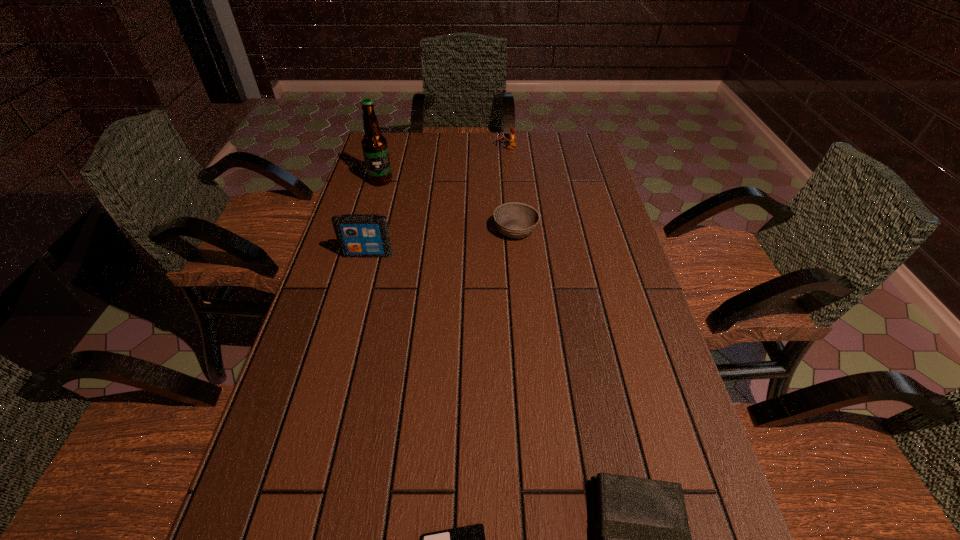
Find the location of `vacant point located between the Lego and the bowl`. vacant point located between the Lego and the bowl is located at coordinates (511, 188).

In order to click on free spot between the bowl and the farthest object in this screenshot , I will do `click(511, 188)`.

At what (x,y) coordinates should I click in order to perform the action: click on empty space between the third tallest object and the taller iPod. Please return your answer as a coordinate pair (x, y). Image resolution: width=960 pixels, height=540 pixels. Looking at the image, I should click on (437, 201).

Select which object appears as the fifth closest to the beer bottle. Please provide its 2D coordinates. Your answer should be formatted as a tuple, i.e. [(x, y)], where the tuple contains the x and y coordinates of a point satisfying the conditions above.

[(641, 538)]

Select which object is the third closest to the taller iPod. Please provide its 2D coordinates. Your answer should be formatted as a tuple, i.e. [(x, y)], where the tuple contains the x and y coordinates of a point satisfying the conditions above.

[(511, 143)]

Locate an element on the screen. The width and height of the screenshot is (960, 540). free location that satisfies the following two spatial constraints: 1. on the back side of the bowl; 2. holding a crossbow in the hands of the Lego is located at coordinates point(508,147).

Locate an element on the screen. vacant area in the image that satisfies the following two spatial constraints: 1. holding a crossbow in the hands of the farthest object; 2. on the front screen of the taller iPod is located at coordinates (516, 254).